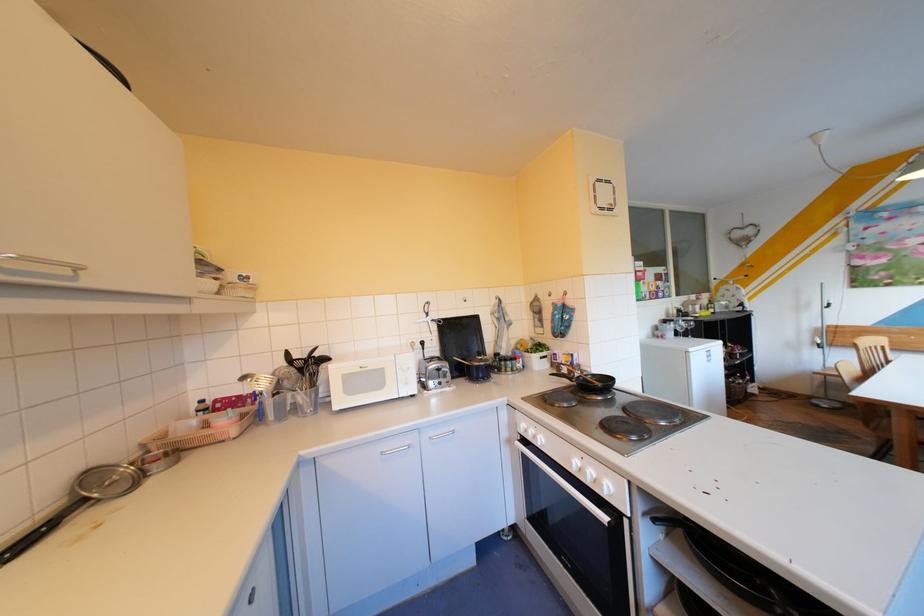
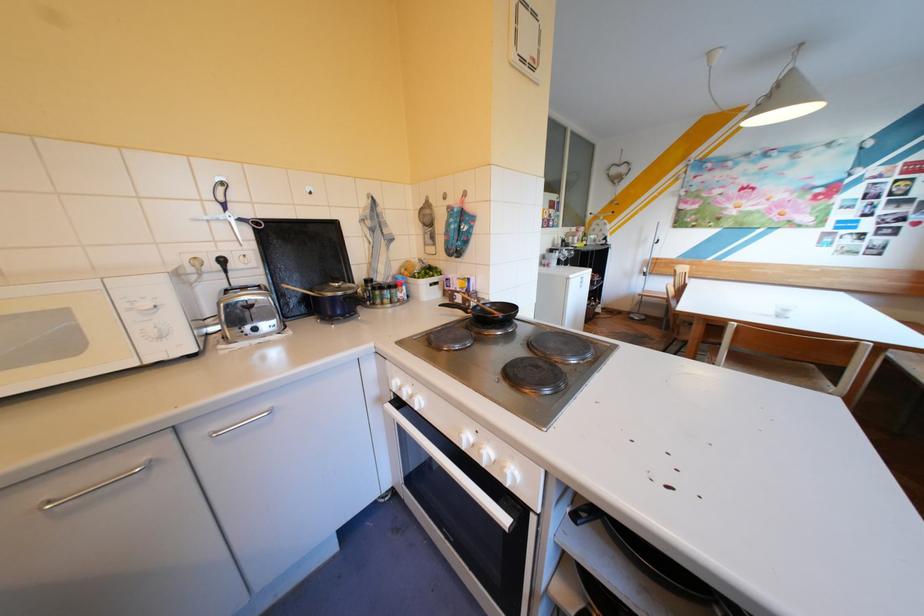
Find the pixel in the second image that matches (x=490, y=363) in the first image.

(343, 294)